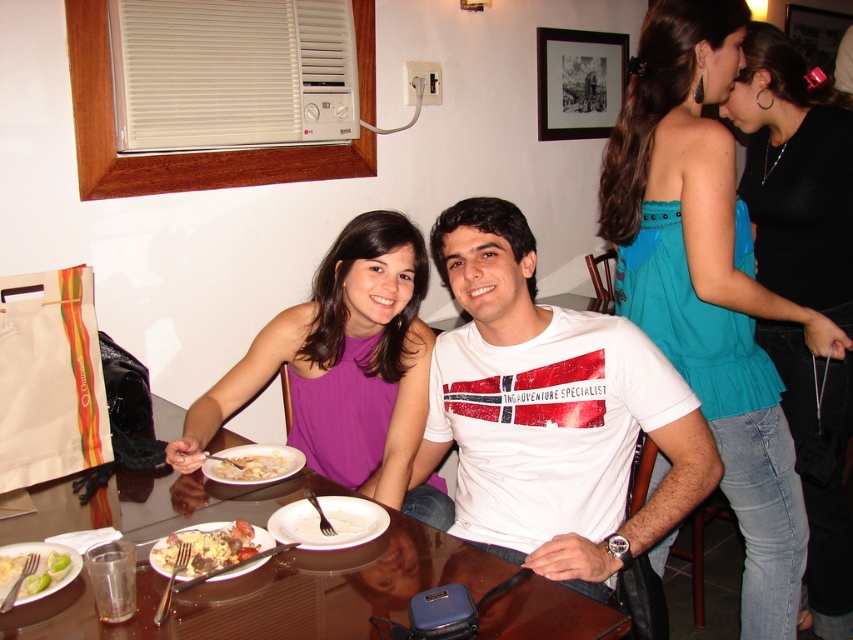
Question: Observing the image, what is the correct spatial positioning of purple ribbed tank top at center in reference to green matte plate at lower left?

Choices:
 (A) above
 (B) below

Answer: (A)

Question: Does white glossy plate at lower center appear on the left side of white creamy soup at center?

Choices:
 (A) no
 (B) yes

Answer: (A)

Question: Which of the following is the closest to the observer?

Choices:
 (A) (648, 518)
 (B) (292, 467)
 (C) (332, 374)

Answer: (A)

Question: Does teal satin blouse at upper right appear on the right side of golden brown rice at center?

Choices:
 (A) no
 (B) yes

Answer: (B)

Question: Which object is positioned closest to the green matte plate at lower left?

Choices:
 (A) white cotton t-shirt at center
 (B) golden brown rice at center

Answer: (B)

Question: Which of the following is the farthest from the observer?

Choices:
 (A) (234, 524)
 (B) (258, 467)

Answer: (B)